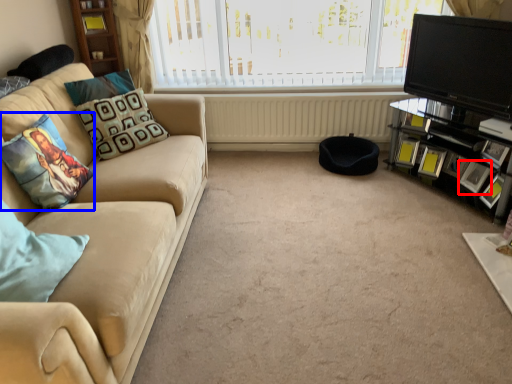
Question: Among these objects, which one is nearest to the camera, picture frame (highlighted by a red box) or pillow (highlighted by a blue box)?

Choices:
 (A) picture frame
 (B) pillow

Answer: (B)